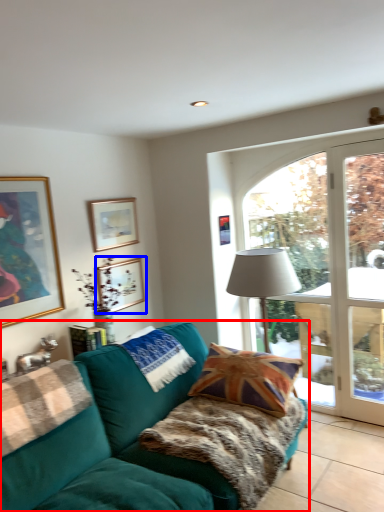
Question: Among these objects, which one is farthest to the camera, studio couch (highlighted by a red box) or picture frame (highlighted by a blue box)?

Choices:
 (A) studio couch
 (B) picture frame

Answer: (B)